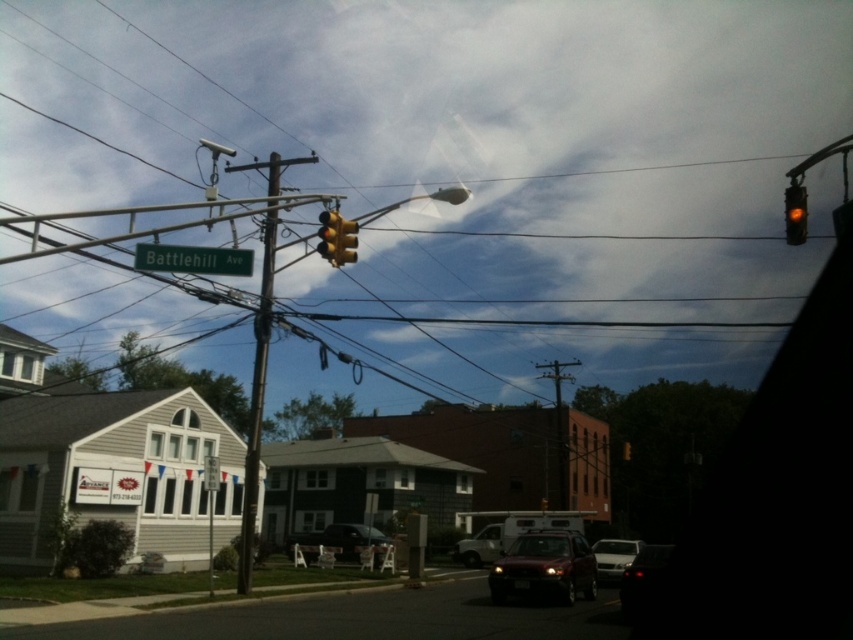
You are a delivery driver who needs to park your shiny black car at lower right in a spot that is 0.8 meters away from the traffic light pole. According to the image, can you park your car there?

The 2D location of shiny black car at lower right is at point (643, 577), so the car is already positioned at that coordinate and cannot be moved further.